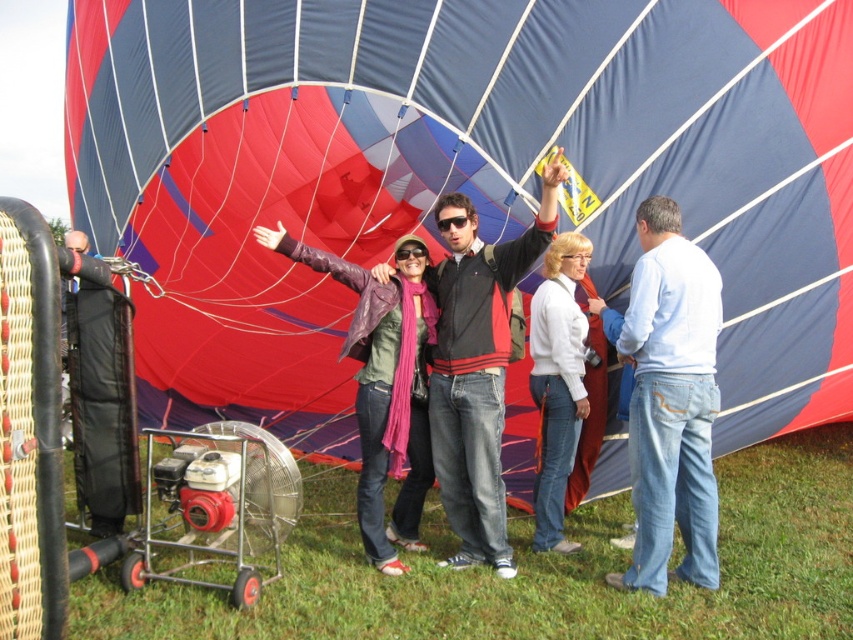
You are a photographer standing 2 meters away from the purple leather jacket at center and the white matte jacket at center. Can you fit both jackets in your camera frame without moving? The camera has a maximum horizontal field of view of 1.5 meters at this distance.

The distance between the purple leather jacket at center and white matte jacket at center is 1.32 meters, which is less than the camera frame width of 1.5 meters. Therefore, both jackets can be captured in the frame without moving.

You are a photographer trying to capture a clear shot of both the blue fabric balloon at center and the black plastic goggles at center. Since both are at the center, which object should you focus on first to ensure the larger one is in frame?

The blue fabric balloon at center has a larger width than the black plastic goggles at center, so you should focus on the blue fabric balloon at center first to ensure it fits within the frame.

You are a photographer taking a group photo of the people near the blue fabric balloon at center and the black plastic goggles at center. Which object should you focus on first if you want to ensure both are in the frame?

The blue fabric balloon at center is bigger than the black plastic goggles at center, so you should focus on the blue fabric balloon at center first to ensure both are in the frame.